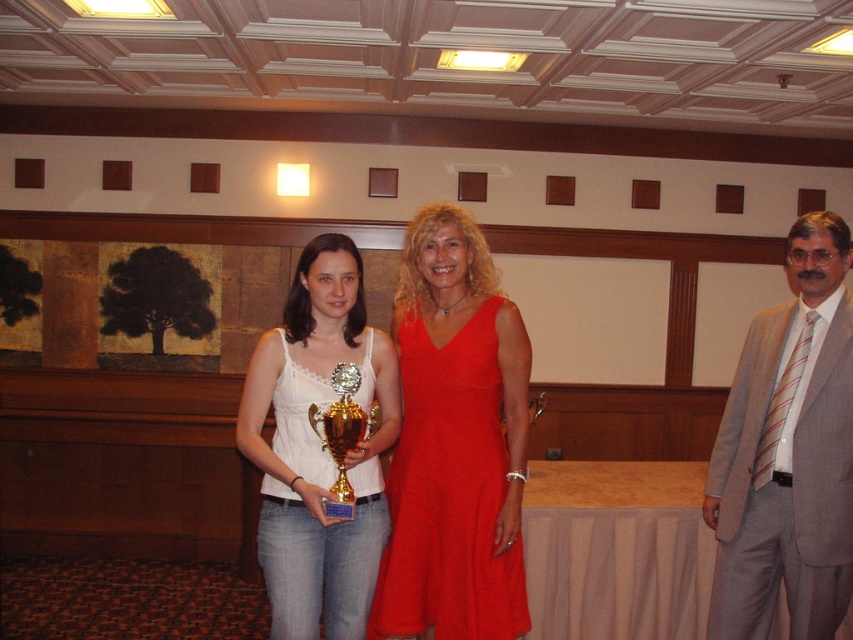
You are a photographer setting up for a group photo. You need to ensure that both the gray suit at right and the red satin dress at center are clearly visible in the frame. Based on their positions, which one is closer to the camera?

The gray suit at right is closer to the camera than the red satin dress at center because it is further to the viewer.

You are standing in the conference room and see two points marked in the image. The first point is at coordinates point [712,484] and the second is at point [358,369]. Which point is farther away from the camera?

Point [712,484] is behind point [358,369], so it is farther away from the camera.

You are a photographer setting up for a group photo in a conference room. You need to position two subjects so that one is centered and the other is slightly off to the right. Given the scene described, can you confirm if the gray suit at right and the red satin dress at center are already positioned correctly for this setup?

Yes, the gray suit at right and the red satin dress at center are positioned correctly. The gray suit at right is to the right of the red satin dress at center, which aligns with the requirement of having one centered and the other off to the right.